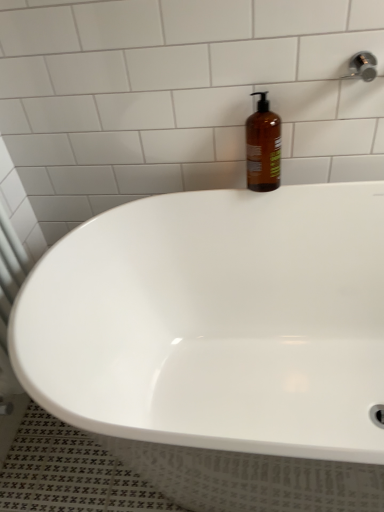
Question: From a real-world perspective, relative to white glossy bathtub at center, is amber glass bottle at upper right vertically above or below?

Choices:
 (A) above
 (B) below

Answer: (A)

Question: In terms of width, does amber glass bottle at upper right look wider or thinner when compared to white glossy bathtub at center?

Choices:
 (A) wide
 (B) thin

Answer: (B)

Question: Considering their positions, is amber glass bottle at upper right located in front of or behind white glossy bathtub at center?

Choices:
 (A) behind
 (B) front

Answer: (A)

Question: Considering their positions, is white glossy bathtub at center located in front of or behind amber glass bottle at upper right?

Choices:
 (A) front
 (B) behind

Answer: (A)

Question: From the image's perspective, is white glossy bathtub at center positioned above or below amber glass bottle at upper right?

Choices:
 (A) above
 (B) below

Answer: (B)

Question: Is point tap(317, 429) closer or farther from the camera than point tap(248, 172)?

Choices:
 (A) closer
 (B) farther

Answer: (A)

Question: Is white glossy bathtub at center wider or thinner than amber glass bottle at upper right?

Choices:
 (A) thin
 (B) wide

Answer: (B)